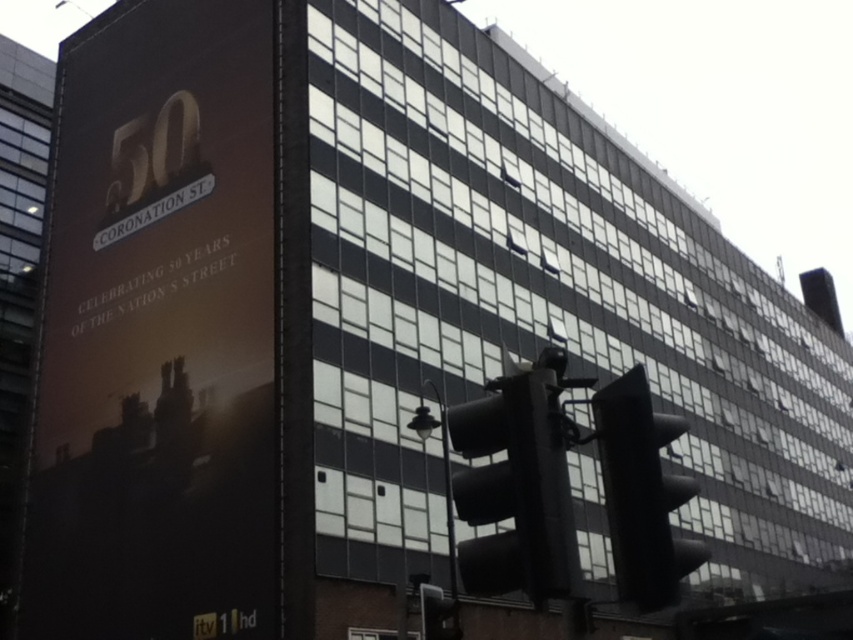
Looking at this image, can you confirm if black matte traffic light at lower center is positioned to the left of black matte traffic light at lower right?

Correct, you'll find black matte traffic light at lower center to the left of black matte traffic light at lower right.

Locate an element on the screen. Image resolution: width=853 pixels, height=640 pixels. black matte traffic light at lower center is located at coordinates (515, 486).

Is black plastic pole at lower center to the left of black plastic traffic light at lower center from the viewer's perspective?

No, black plastic pole at lower center is not to the left of black plastic traffic light at lower center.

Is black plastic pole at lower center thinner than black plastic traffic light at lower center?

Incorrect, black plastic pole at lower center's width is not less than black plastic traffic light at lower center's.

Between point (447, 515) and point (440, 630), which one is positioned in front?

Point (440, 630)

At what (x,y) coordinates should I click in order to perform the action: click on black plastic pole at lower center. Please return your answer as a coordinate pair (x, y). Image resolution: width=853 pixels, height=640 pixels. Looking at the image, I should click on (445, 493).

Who is positioned more to the left, black matte traffic light at lower right or black plastic traffic light at lower center?

black plastic traffic light at lower center is more to the left.

Does black matte traffic light at lower right have a smaller size compared to black plastic traffic light at lower center?

No, black matte traffic light at lower right is not smaller than black plastic traffic light at lower center.

Where is `black matte traffic light at lower right`? The height and width of the screenshot is (640, 853). black matte traffic light at lower right is located at coordinates (641, 493).